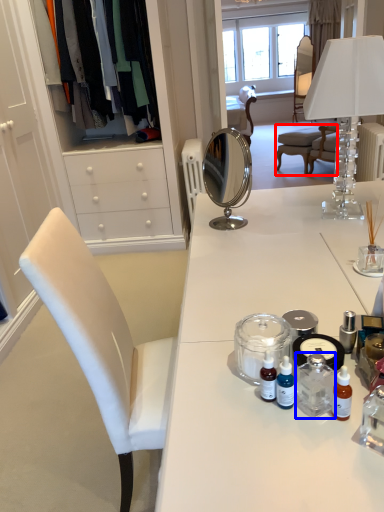
Question: Among these objects, which one is nearest to the camera, chair (highlighted by a red box) or bottle (highlighted by a blue box)?

Choices:
 (A) chair
 (B) bottle

Answer: (B)